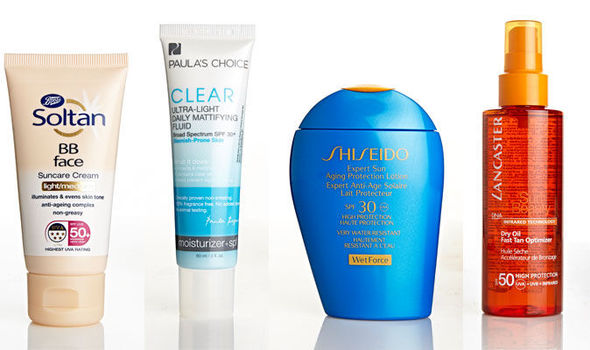
You are a GUI agent. You are given a task and a screenshot of the screen. Output one action in this format:
    pyautogui.click(x=<x>, y=<y>)
    Task: Click on the translucent red bottle
    
    Given the screenshot: What is the action you would take?
    pyautogui.click(x=555, y=175)